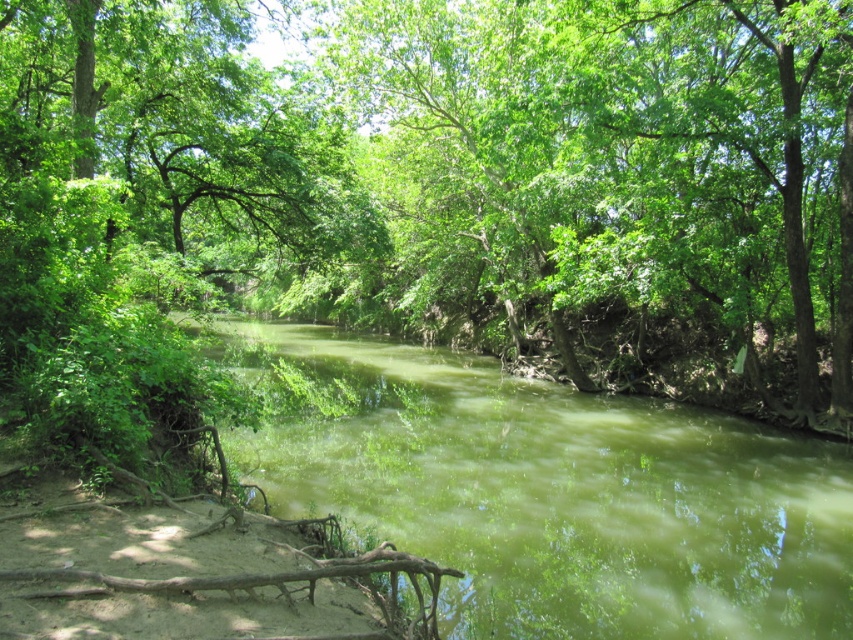
Does green leafy tree at center appear on the left side of green murky water at center?

Correct, you'll find green leafy tree at center to the left of green murky water at center.

The width and height of the screenshot is (853, 640). Describe the element at coordinates (486, 173) in the screenshot. I see `green leafy tree at center` at that location.

Where is `green leafy tree at center`? The image size is (853, 640). green leafy tree at center is located at coordinates (486, 173).